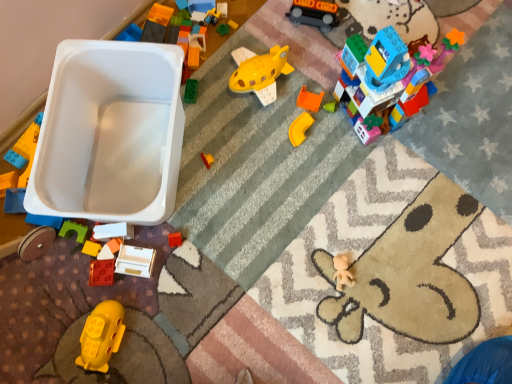
Locate an element on the screen. The image size is (512, 384). free area in between yellow matte plastic corner piece at center-right, acting as the 6th toy starting from the left, and white plastic toy car at upper left is located at coordinates (234, 158).